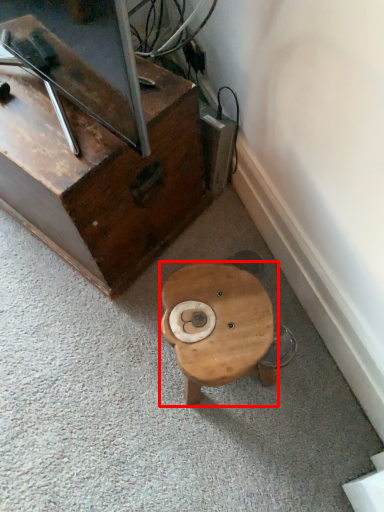
Question: From the image, what is the correct spatial relationship of table (annotated by the red box) in relation to furniture?

Choices:
 (A) left
 (B) right

Answer: (B)